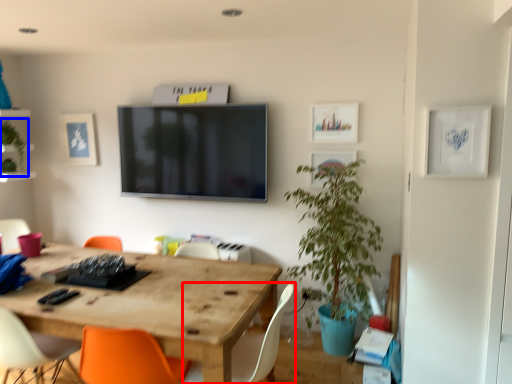
Question: Which object appears closest to the camera in this image, chair (highlighted by a red box) or plant (highlighted by a blue box)?

Choices:
 (A) chair
 (B) plant

Answer: (A)